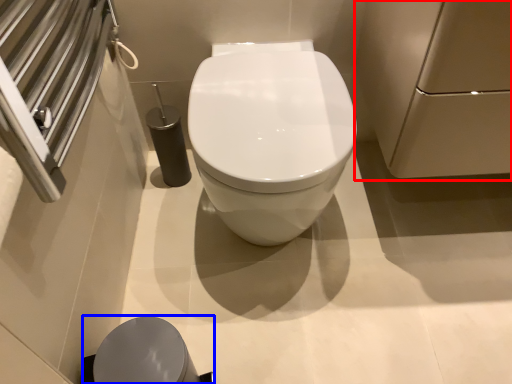
Question: Which of the following is the farthest to the observer, screen door (highlighted by a red box) or porcelain (highlighted by a blue box)?

Choices:
 (A) screen door
 (B) porcelain

Answer: (B)